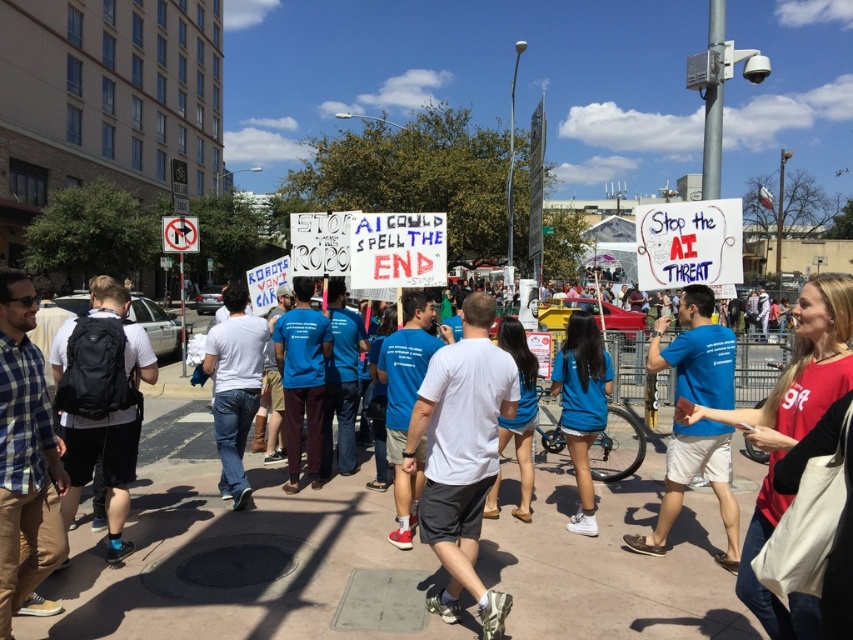
Is point (474, 509) positioned in front of point (228, 352)?

Yes, point (474, 509) is closer to viewer.

Locate an element on the screen. This screenshot has width=853, height=640. white cotton t-shirt at center is located at coordinates (462, 456).

Is point (485, 470) positioned before point (213, 385)?

Yes.

This screenshot has width=853, height=640. I want to click on white cotton t-shirt at center, so click(462, 456).